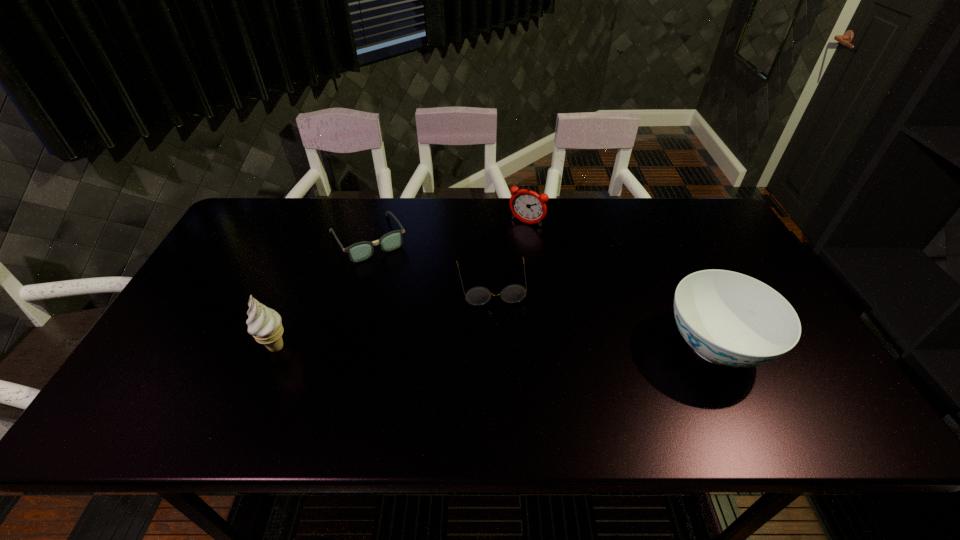
Find the location of a particular element. free spot between the left spectacles and the chinaware is located at coordinates (541, 292).

Identify the location of free spot between the tallest object and the right spectacles. (383, 315).

This screenshot has height=540, width=960. What are the coordinates of `free space between the alarm clock and the left spectacles` in the screenshot? It's located at (447, 231).

The width and height of the screenshot is (960, 540). In order to click on free space between the tallest object and the chinaware in this screenshot , I will do `click(495, 346)`.

Identify the location of free point between the right spectacles and the tallest object. The image size is (960, 540). (383, 315).

At what (x,y) coordinates should I click in order to perform the action: click on vacant space in between the left spectacles and the rightmost object. Please return your answer as a coordinate pair (x, y). The width and height of the screenshot is (960, 540). Looking at the image, I should click on (541, 292).

Locate an element on the screen. The height and width of the screenshot is (540, 960). vacant space that is in between the rightmost object and the right spectacles is located at coordinates (602, 314).

This screenshot has width=960, height=540. I want to click on object that is the closest to the tallest object, so click(x=360, y=251).

The width and height of the screenshot is (960, 540). Identify the location of the closest object to the alarm clock. (514, 293).

Find the location of a particular element. This screenshot has width=960, height=540. vacant space that satisfies the following two spatial constraints: 1. on the back side of the alarm clock; 2. on the left side of the left spectacles is located at coordinates (372, 223).